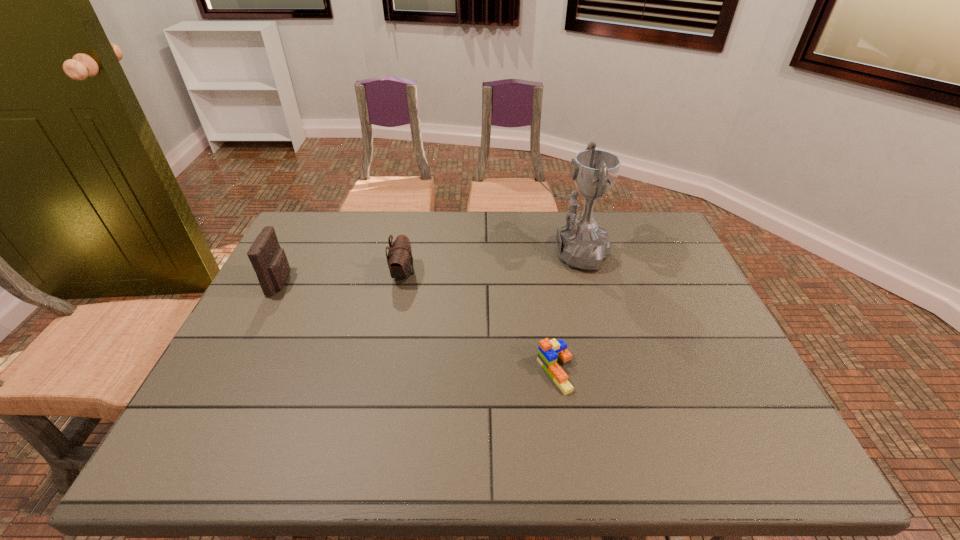
You are a GUI agent. You are given a task and a screenshot of the screen. Output one action in this format:
    pyautogui.click(x=<x>, y=<y>)
    Task: Click on the free point between the shorter pouch and the Lego
    The width and height of the screenshot is (960, 540).
    Given the screenshot: What is the action you would take?
    pyautogui.click(x=479, y=323)

Choose which object is the nearest neighbor to the third shortest object. Please provide its 2D coordinates. Your answer should be formatted as a tuple, i.e. [(x, y)], where the tuple contains the x and y coordinates of a point satisfying the conditions above.

[(400, 261)]

Select which object is the third closest to the taller pouch. Please provide its 2D coordinates. Your answer should be formatted as a tuple, i.e. [(x, y)], where the tuple contains the x and y coordinates of a point satisfying the conditions above.

[(581, 243)]

The width and height of the screenshot is (960, 540). What are the coordinates of `free location that satisfies the following two spatial constraints: 1. with an open flap on the shortest object; 2. on the left side of the leftmost object` in the screenshot? It's located at (236, 372).

Find the location of a particular element. The width and height of the screenshot is (960, 540). free location that satisfies the following two spatial constraints: 1. on the side with emblem of the award; 2. on the front side of the Lego is located at coordinates (600, 372).

I want to click on free space that satisfies the following two spatial constraints: 1. on the back side of the Lego; 2. with the flap open on the second shortest object, so click(540, 274).

This screenshot has width=960, height=540. What are the coordinates of `vacant region that satisfies the following two spatial constraints: 1. with the flap open on the shortest object; 2. on the left side of the shorter pouch` in the screenshot? It's located at (383, 372).

Locate an element on the screen. free spot that satisfies the following two spatial constraints: 1. with the flap open on the nearest object; 2. on the left side of the second shortest object is located at coordinates (383, 372).